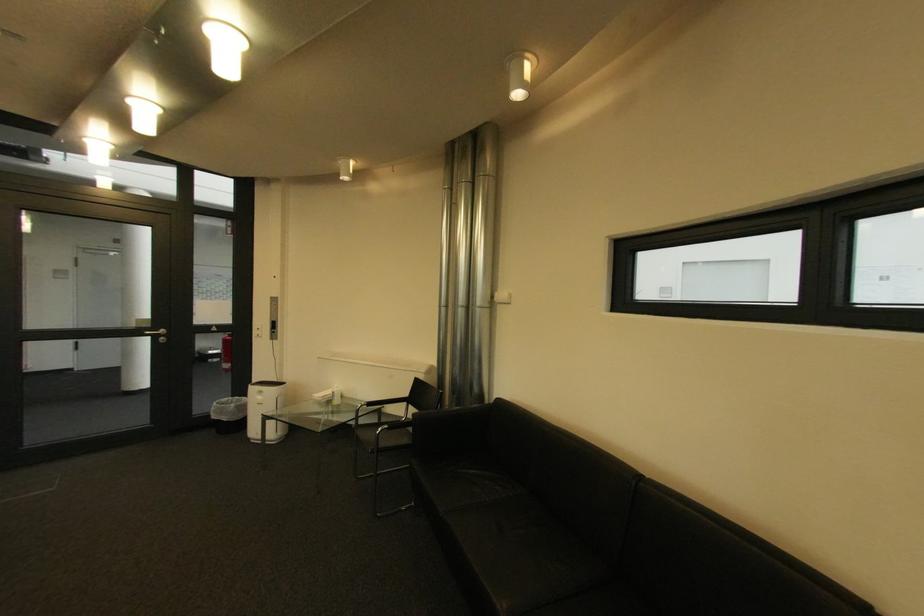
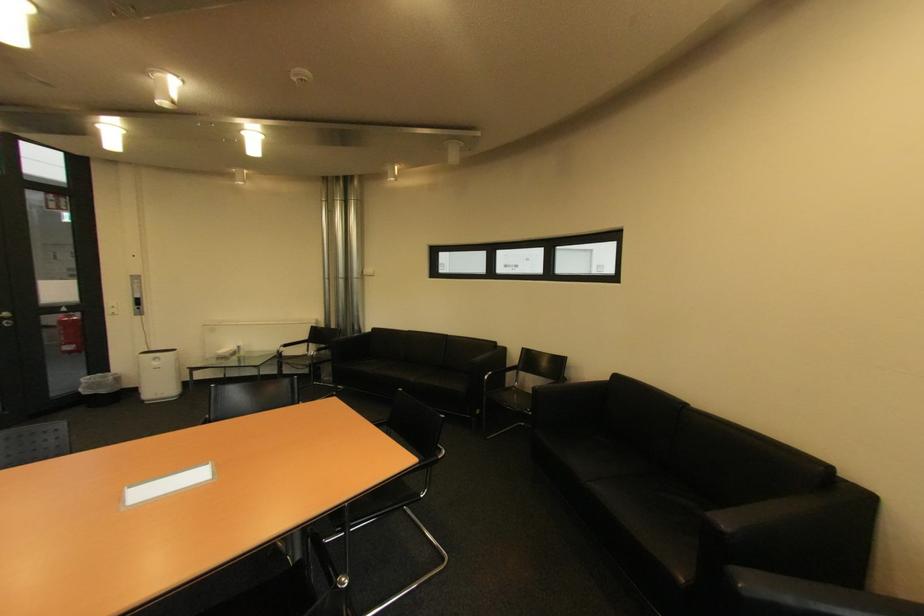
In the second image, find the point that corresponds to the point at 171,331 in the first image.

(14, 315)